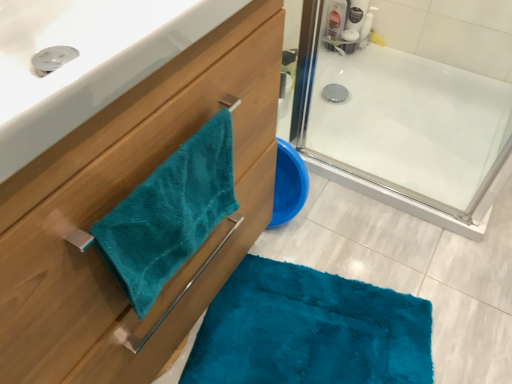
Question: Can you confirm if teal plush towel at left is taller than translucent plastic bottle at upper right?

Choices:
 (A) no
 (B) yes

Answer: (B)

Question: Does teal plush towel at left touch translucent plastic bottle at upper right?

Choices:
 (A) yes
 (B) no

Answer: (B)

Question: Can you confirm if teal plush towel at left is shorter than translucent plastic bottle at upper right?

Choices:
 (A) no
 (B) yes

Answer: (A)

Question: Would you say teal plush towel at left is outside translucent plastic bottle at upper right?

Choices:
 (A) no
 (B) yes

Answer: (B)

Question: Is the position of teal plush towel at left more distant than that of translucent plastic bottle at upper right?

Choices:
 (A) yes
 (B) no

Answer: (B)

Question: Is translucent plastic bottle at upper right at the back of teal plush towel at left?

Choices:
 (A) no
 (B) yes

Answer: (A)

Question: Is teal plush towel at left positioned far away from teal plush towel at left?

Choices:
 (A) yes
 (B) no

Answer: (B)

Question: Are teal plush towel at left and teal plush towel at left making contact?

Choices:
 (A) no
 (B) yes

Answer: (A)

Question: Does teal plush towel at left have a lesser height compared to teal plush towel at left?

Choices:
 (A) no
 (B) yes

Answer: (B)

Question: From the image's perspective, is teal plush towel at left located above teal plush towel at left?

Choices:
 (A) yes
 (B) no

Answer: (B)

Question: Is teal plush towel at left to the left of teal plush towel at left from the viewer's perspective?

Choices:
 (A) yes
 (B) no

Answer: (B)

Question: Can you confirm if teal plush towel at left is wider than teal plush towel at left?

Choices:
 (A) yes
 (B) no

Answer: (B)

Question: From a real-world perspective, is translucent plastic bottle at upper right on teal plush towel at left?

Choices:
 (A) no
 (B) yes

Answer: (A)